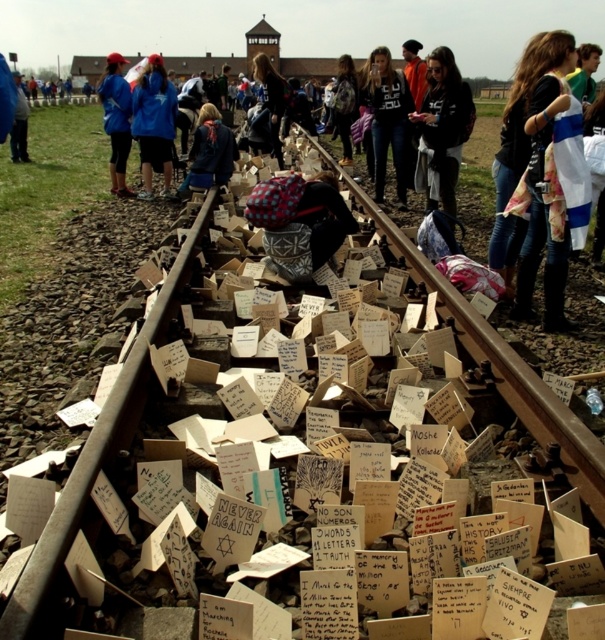
Question: Can you confirm if black jacket at center is positioned to the left of dark blue jeans at center?

Choices:
 (A) no
 (B) yes

Answer: (A)

Question: Which object appears closest to the camera in this image?

Choices:
 (A) dark brown leather jacket at center
 (B) blue fleece jacket at center
 (C) blue fabric jacket at center

Answer: (C)

Question: Which point is farther from the camera taking this photo?

Choices:
 (A) (122, 163)
 (B) (188, 184)
 (C) (151, 90)

Answer: (A)

Question: Which point is closer to the camera?

Choices:
 (A) dark blue jacket at left
 (B) blue fabric jacket at center
 (C) dark brown leather jacket at center
 (D) black jacket at center

Answer: (D)

Question: Can you confirm if black jacket at center is smaller than plaid fabric hat at center?

Choices:
 (A) yes
 (B) no

Answer: (A)

Question: Can you confirm if black jacket at center is positioned below plaid fabric hat at center?

Choices:
 (A) yes
 (B) no

Answer: (A)